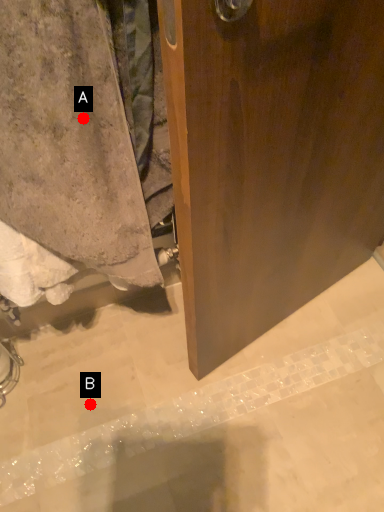
Question: Two points are circled on the image, labeled by A and B beside each circle. Which point is closer to the camera?

Choices:
 (A) A is closer
 (B) B is closer

Answer: (A)